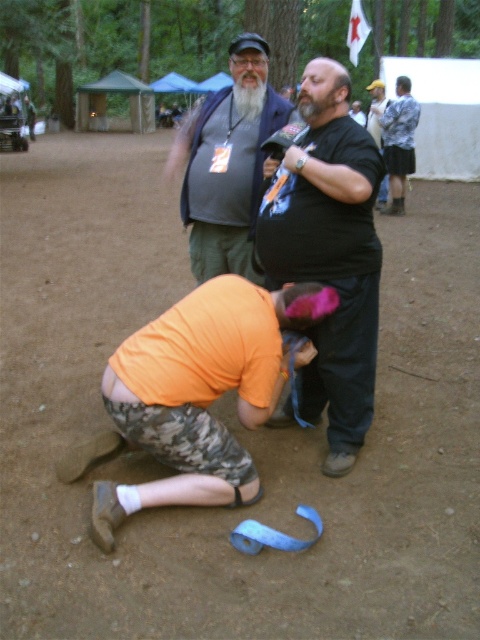
Between point (201, 445) and point (216, 93), which one is positioned behind?

The point (216, 93) is more distant.

Is orange fabric at lower center to the left of matte gray vest at center from the viewer's perspective?

In fact, orange fabric at lower center is to the right of matte gray vest at center.

Is point (252, 385) positioned before point (216, 116)?

Yes, point (252, 385) is in front of point (216, 116).

The width and height of the screenshot is (480, 640). What are the coordinates of `orange fabric at lower center` in the screenshot? It's located at (200, 392).

Who is taller, orange fabric at lower center or black matte shirt at center?

With more height is black matte shirt at center.

Which is more to the right, orange fabric at lower center or black matte shirt at center?

Positioned to the right is black matte shirt at center.

Does point (141, 500) come closer to viewer compared to point (311, 156)?

Yes, point (141, 500) is in front of point (311, 156).

Identify the location of orange fabric at lower center. This screenshot has height=640, width=480. (200, 392).

Between black matte shirt at center and matte gray vest at center, which one appears on the right side from the viewer's perspective?

black matte shirt at center

Does point (361, 228) come in front of point (229, 157)?

Yes.

Is point (264, 224) positioned before point (226, 163)?

Yes, point (264, 224) is in front of point (226, 163).

The image size is (480, 640). Find the location of `black matte shirt at center`. black matte shirt at center is located at coordinates (328, 252).